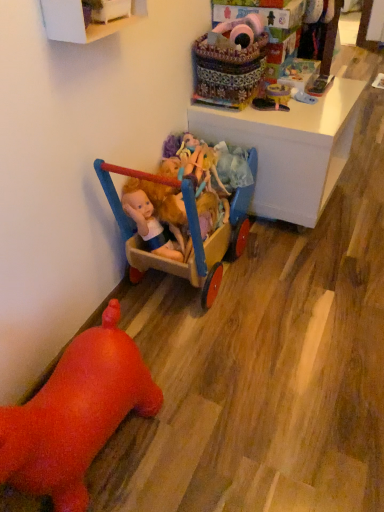
Where is `empty space that is in between brightly colored fabric basket at upper center and black rubber shoe at upper right, which is the 4th toy from bottom to top`? empty space that is in between brightly colored fabric basket at upper center and black rubber shoe at upper right, which is the 4th toy from bottom to top is located at coordinates (270, 112).